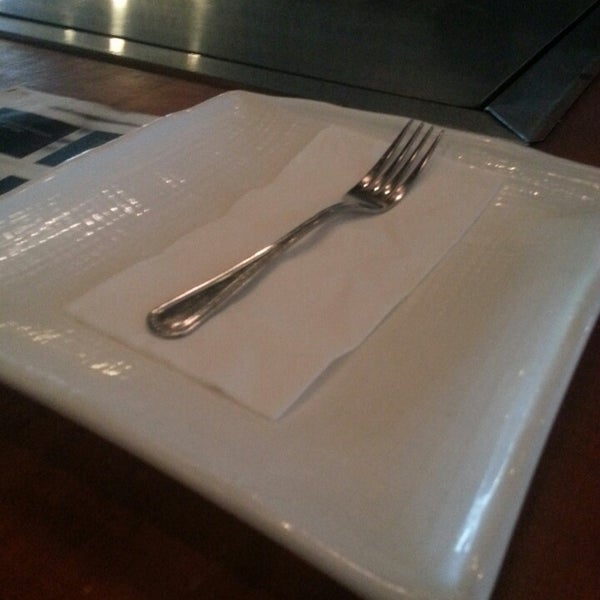
Locate an element on the screen. This screenshot has height=600, width=600. wooden table left of plate is located at coordinates (150, 89).